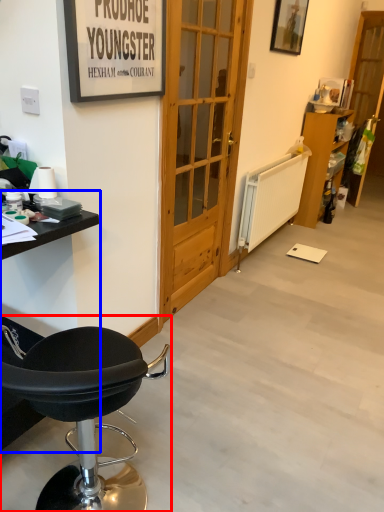
Question: Which object appears farthest to the camera in this image, chair (highlighted by a red box) or table (highlighted by a blue box)?

Choices:
 (A) chair
 (B) table

Answer: (B)